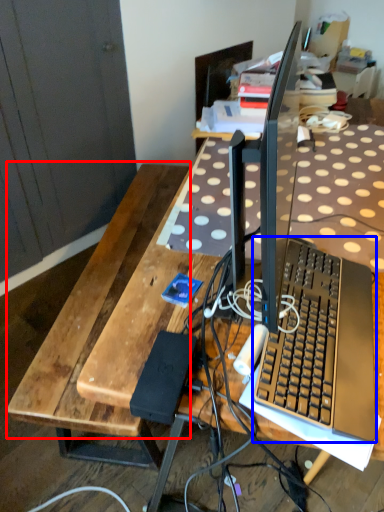
Question: Which object appears farthest to the camera in this image, wood (highlighted by a red box) or computer keyboard (highlighted by a blue box)?

Choices:
 (A) wood
 (B) computer keyboard

Answer: (A)